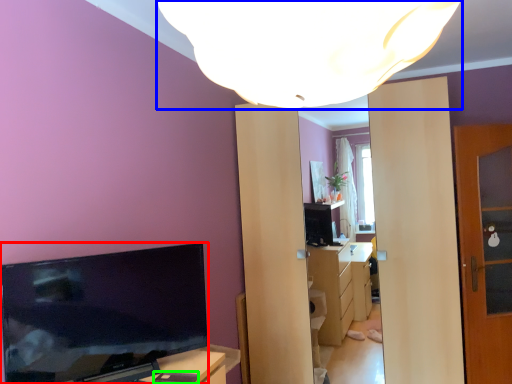
Question: Which is farther away from television (highlighted by a red box)? lamp (highlighted by a blue box) or mobile phone (highlighted by a green box)?

Choices:
 (A) lamp
 (B) mobile phone

Answer: (A)